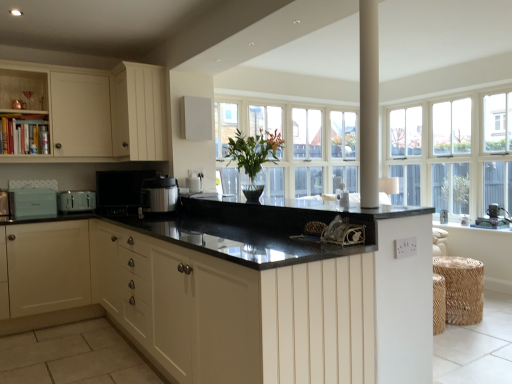
Identify the location of white matte speaker at upper center, acting as the 1th appliance starting from the right. Image resolution: width=512 pixels, height=384 pixels. (195, 118).

You are a GUI agent. You are given a task and a screenshot of the screen. Output one action in this format:
    pyautogui.click(x=<x>, y=<y>)
    Task: Click on the white wood cabinet at upper left
    
    Given the screenshot: What is the action you would take?
    pyautogui.click(x=138, y=112)

The image size is (512, 384). What do you see at coordinates (33, 202) in the screenshot?
I see `teal matte toaster at left, the 1th appliance in the left-to-right sequence` at bounding box center [33, 202].

Find the location of a particular element. This screenshot has width=512, height=384. woven straw stool at lower right is located at coordinates (462, 288).

How much space does black granite countertop at center, which appears as the 2th countertop when ordered from the bottom, occupy vertically?

It is 1.58 inches.

What is the approximate height of green glossy vase at center?

The height of green glossy vase at center is 49.95 centimeters.

The width and height of the screenshot is (512, 384). Find the location of `black matte microwave at center, placed as the 3th appliance when sorted from left to right`. black matte microwave at center, placed as the 3th appliance when sorted from left to right is located at coordinates (120, 191).

Is black matte microwave at center, arranged as the third appliance when viewed from the right, completely or partially inside white matte speaker at upper center, positioned as the fifth appliance in left-to-right order?

No, black matte microwave at center, arranged as the third appliance when viewed from the right, is not inside white matte speaker at upper center, positioned as the fifth appliance in left-to-right order.

From the image's perspective, is white matte speaker at upper center, positioned as the fifth appliance in left-to-right order, above black matte microwave at center, placed as the 3th appliance when sorted from left to right?

Indeed, from the image's perspective, white matte speaker at upper center, positioned as the fifth appliance in left-to-right order, is shown above black matte microwave at center, placed as the 3th appliance when sorted from left to right.

Considering the relative positions of white matte speaker at upper center, acting as the 1th appliance starting from the right, and black matte microwave at center, placed as the 3th appliance when sorted from left to right, in the image provided, is white matte speaker at upper center, acting as the 1th appliance starting from the right, to the right of black matte microwave at center, placed as the 3th appliance when sorted from left to right, from the viewer's perspective?

Indeed, white matte speaker at upper center, acting as the 1th appliance starting from the right, is positioned on the right side of black matte microwave at center, placed as the 3th appliance when sorted from left to right.

Is matte silver toaster at left, which is the 2th appliance in left-to-right order, taller or shorter than green glossy vase at center?

matte silver toaster at left, which is the 2th appliance in left-to-right order, is shorter than green glossy vase at center.

From a real-world perspective, between matte silver toaster at left, which is the 4th appliance in right-to-left order, and green glossy vase at center, who is vertically higher?

From a 3D spatial view, green glossy vase at center is above.

Is matte silver toaster at left, which is the 2th appliance in left-to-right order, with green glossy vase at center?

matte silver toaster at left, which is the 2th appliance in left-to-right order, and green glossy vase at center are clearly separated.

Based on their positions, is green glossy vase at center located to the left or right of woven straw stool at lower right?

In the image, green glossy vase at center appears on the left side of woven straw stool at lower right.

From the picture: Considering the relative sizes of green glossy vase at center and woven straw stool at lower right in the image provided, is green glossy vase at center bigger than woven straw stool at lower right?

Yes.

Is woven straw stool at lower right at the back of green glossy vase at center?

No.

Is woven straw stool at lower right completely or partially inside green glossy vase at center?

No, woven straw stool at lower right is not inside green glossy vase at center.

Is teal matte toaster at left, the 1th appliance in the left-to-right sequence, facing towards green glossy vase at center?

No, teal matte toaster at left, the 1th appliance in the left-to-right sequence, is not aimed at green glossy vase at center.

Considering the sizes of objects teal matte toaster at left, the 1th appliance in the left-to-right sequence, and green glossy vase at center in the image provided, who is wider, teal matte toaster at left, the 1th appliance in the left-to-right sequence, or green glossy vase at center?

green glossy vase at center.

In the scene shown: From a real-world perspective, between teal matte toaster at left, which is the fifth appliance from right to left, and green glossy vase at center, who is vertically higher?

From a 3D spatial view, green glossy vase at center is above.

In terms of height, does teal matte toaster at left, the 1th appliance in the left-to-right sequence, look taller or shorter compared to green glossy vase at center?

Considering their sizes, teal matte toaster at left, the 1th appliance in the left-to-right sequence, has less height than green glossy vase at center.

Based on the photo, from the image's perspective, is white textured window sill at right above or below matte black pressure cooker at center, marked as the 2th appliance in a right-to-left arrangement?

white textured window sill at right is below matte black pressure cooker at center, marked as the 2th appliance in a right-to-left arrangement.

Is white textured window sill at right with matte black pressure cooker at center, which is counted as the fourth appliance, starting from the left?

white textured window sill at right is not next to matte black pressure cooker at center, which is counted as the fourth appliance, starting from the left, and they're not touching.

From the picture: From a real-world perspective, is white textured window sill at right under matte black pressure cooker at center, marked as the 2th appliance in a right-to-left arrangement?

Indeed, from a real-world perspective, white textured window sill at right is positioned beneath matte black pressure cooker at center, marked as the 2th appliance in a right-to-left arrangement.

Considering the positions of objects white textured window sill at right and matte black pressure cooker at center, which is counted as the fourth appliance, starting from the left, in the image provided, who is more to the left, white textured window sill at right or matte black pressure cooker at center, which is counted as the fourth appliance, starting from the left,?

Positioned to the left is matte black pressure cooker at center, which is counted as the fourth appliance, starting from the left.

Is black granite countertop at center, the second countertop in the top-to-bottom sequence, to the left of white wood cabinet at upper left from the viewer's perspective?

In fact, black granite countertop at center, the second countertop in the top-to-bottom sequence, is to the right of white wood cabinet at upper left.

Which object is further away from the camera taking this photo, black granite countertop at center, the second countertop in the top-to-bottom sequence, or white wood cabinet at upper left?

Positioned behind is white wood cabinet at upper left.

From the image's perspective, who appears lower, black granite countertop at center, the second countertop in the top-to-bottom sequence, or white wood cabinet at upper left?

black granite countertop at center, the second countertop in the top-to-bottom sequence.

Which of these two, black granite countertop at center, the second countertop in the top-to-bottom sequence, or woven straw stool at lower right, stands taller?

black granite countertop at center, the second countertop in the top-to-bottom sequence.

Is black granite countertop at center, the second countertop in the top-to-bottom sequence, wider than woven straw stool at lower right?

Yes, black granite countertop at center, the second countertop in the top-to-bottom sequence, is wider than woven straw stool at lower right.

Based on the photo, is woven straw stool at lower right a part of black granite countertop at center, which is counted as the first countertop, starting from the bottom?

No.

Consider the image. Could you tell me if black granite countertop at center, the second countertop in the top-to-bottom sequence, is facing woven straw stool at lower right?

No, black granite countertop at center, the second countertop in the top-to-bottom sequence, does not turn towards woven straw stool at lower right.

Identify the location of appliance above the black matte microwave at center, placed as the 3th appliance when sorted from left to right (from the image's perspective). 195,118.

This screenshot has width=512, height=384. Find the location of `plant located in front of the matte silver toaster at left, which is the 2th appliance in left-to-right order`. plant located in front of the matte silver toaster at left, which is the 2th appliance in left-to-right order is located at coordinates (254, 151).

Consider the image. Estimate the real-world distances between objects in this image. Which object is closer to black granite countertop at center, which is counted as the first countertop, starting from the bottom, green glossy vase at center or black granite countertop at center, the 1th countertop viewed from the top?

Among the two, black granite countertop at center, the 1th countertop viewed from the top, is located nearer to black granite countertop at center, which is counted as the first countertop, starting from the bottom.

Looking at the image, which one is located further to teal matte toaster at left, which is the fifth appliance from right to left, woven straw stool at lower right or white matte speaker at upper center, acting as the 1th appliance starting from the right?

woven straw stool at lower right is further to teal matte toaster at left, which is the fifth appliance from right to left.

Estimate the real-world distances between objects in this image. Which object is closer to black granite countertop at center, which is counted as the first countertop, starting from the bottom, white wood cabinet at upper left or teal matte toaster at left, which is the fifth appliance from right to left?

Based on the image, white wood cabinet at upper left appears to be nearer to black granite countertop at center, which is counted as the first countertop, starting from the bottom.

Based on their spatial positions, is black matte microwave at center, arranged as the third appliance when viewed from the right, or white matte speaker at upper center, positioned as the fifth appliance in left-to-right order, further from green glossy vase at center?

black matte microwave at center, arranged as the third appliance when viewed from the right, is further to green glossy vase at center.

Estimate the real-world distances between objects in this image. Which object is closer to matte black pressure cooker at center, which is counted as the fourth appliance, starting from the left, matte silver toaster at left, which is the 2th appliance in left-to-right order, or black granite countertop at center, the second countertop in the top-to-bottom sequence?

matte silver toaster at left, which is the 2th appliance in left-to-right order.

Based on their spatial positions, is white textured window sill at right or woven straw stool at lower right closer to black matte microwave at center, arranged as the third appliance when viewed from the right?

woven straw stool at lower right.

Estimate the real-world distances between objects in this image. Which object is further from white matte speaker at upper center, positioned as the fifth appliance in left-to-right order, teal matte toaster at left, the 1th appliance in the left-to-right sequence, or matte black pressure cooker at center, which is counted as the fourth appliance, starting from the left?

Among the two, teal matte toaster at left, the 1th appliance in the left-to-right sequence, is located further to white matte speaker at upper center, positioned as the fifth appliance in left-to-right order.

Looking at the image, which one is located further to matte silver toaster at left, which is the 4th appliance in right-to-left order, woven straw stool at lower right or black granite countertop at center, which appears as the 2th countertop when ordered from the bottom?

Among the two, woven straw stool at lower right is located further to matte silver toaster at left, which is the 4th appliance in right-to-left order.

At what (x,y) coordinates should I click in order to perform the action: click on countertop located between matte black pressure cooker at center, marked as the 2th appliance in a right-to-left arrangement, and woven straw stool at lower right in the left-right direction. Please return your answer as a coordinate pair (x, y). The image size is (512, 384). Looking at the image, I should click on (290, 208).

At what (x,y) coordinates should I click in order to perform the action: click on plant between matte silver toaster at left, which is the 4th appliance in right-to-left order, and woven straw stool at lower right, in the horizontal direction. Please return your answer as a coordinate pair (x, y). This screenshot has width=512, height=384. Looking at the image, I should click on (254, 151).

Image resolution: width=512 pixels, height=384 pixels. Identify the location of window between white wood cabinet at upper left and white textured window sill at right from left to right. (452, 153).

At what (x,y) coordinates should I click in order to perform the action: click on window between teal matte toaster at left, which is the fifth appliance from right to left, and white textured window sill at right. Please return your answer as a coordinate pair (x, y). Image resolution: width=512 pixels, height=384 pixels. Looking at the image, I should click on (452, 153).